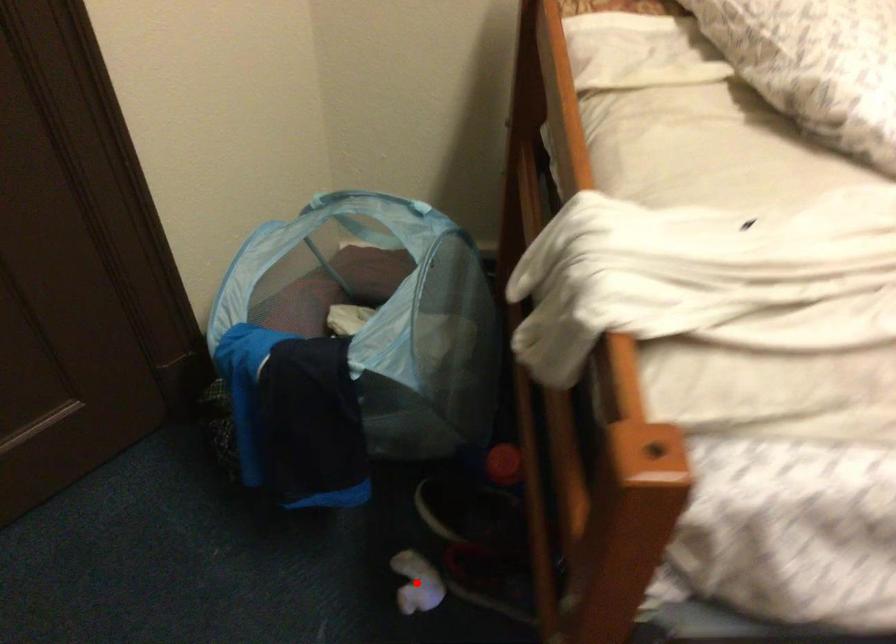
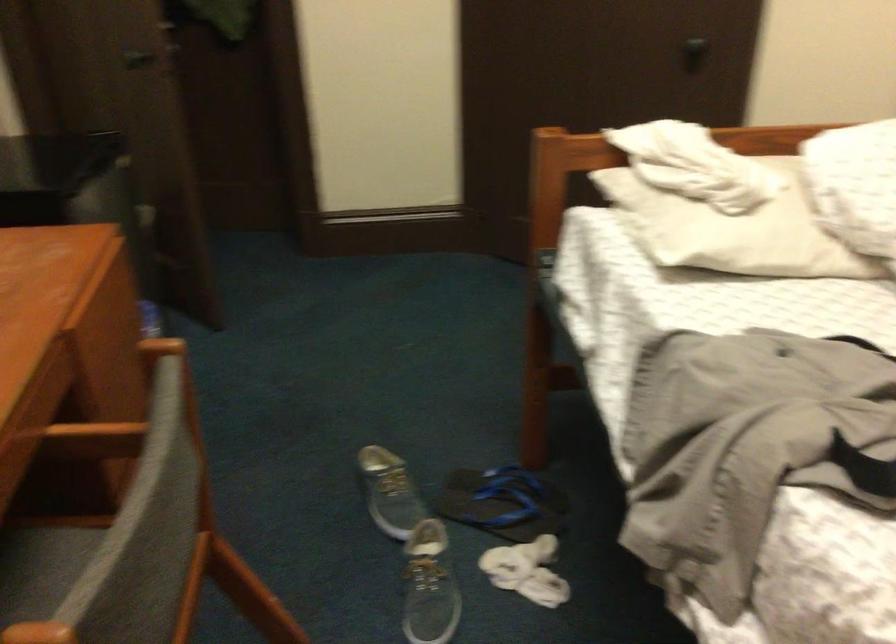
Question: I am providing you with two images of the same scene from different viewpoints. A red point is marked on the first image. Can you still see the location of the red point in image 2?

Choices:
 (A) Yes
 (B) No

Answer: (B)